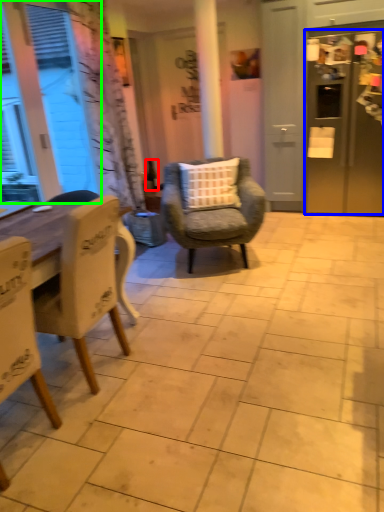
Question: Based on their relative distances, which object is farther from bottle (highlighted by a red box)? Choose from refrigerator (highlighted by a blue box) and window screen (highlighted by a green box).

Choices:
 (A) refrigerator
 (B) window screen

Answer: (A)